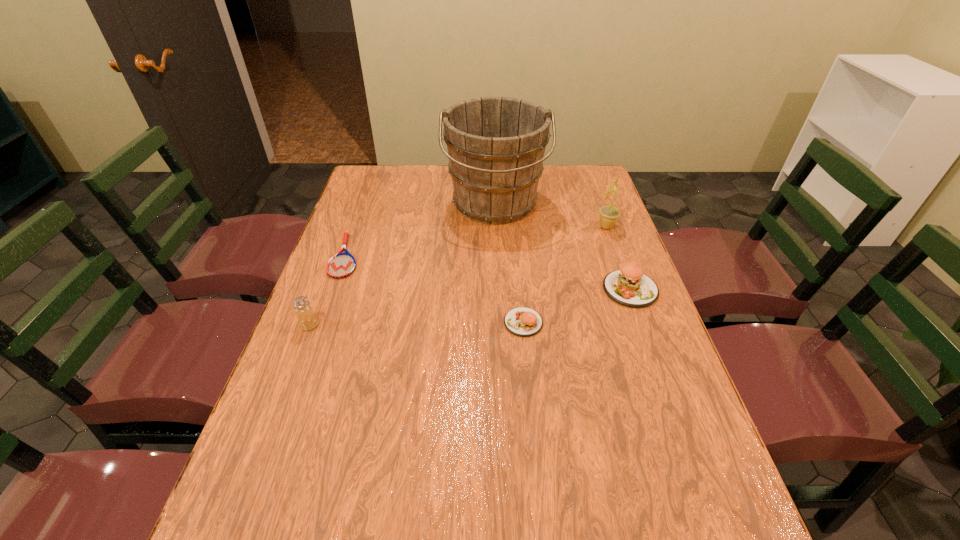
Where is `free space that satisfies the following two spatial constraints: 1. on the back side of the shorter patty; 2. on the left side of the third tallest object`? free space that satisfies the following two spatial constraints: 1. on the back side of the shorter patty; 2. on the left side of the third tallest object is located at coordinates (310, 322).

You are a GUI agent. You are given a task and a screenshot of the screen. Output one action in this format:
    pyautogui.click(x=<x>, y=<y>)
    Task: Click on the free space that satisfies the following two spatial constraints: 1. on the handle side of the bucket; 2. on the right side of the shorter patty
    
    Given the screenshot: What is the action you would take?
    pyautogui.click(x=500, y=322)